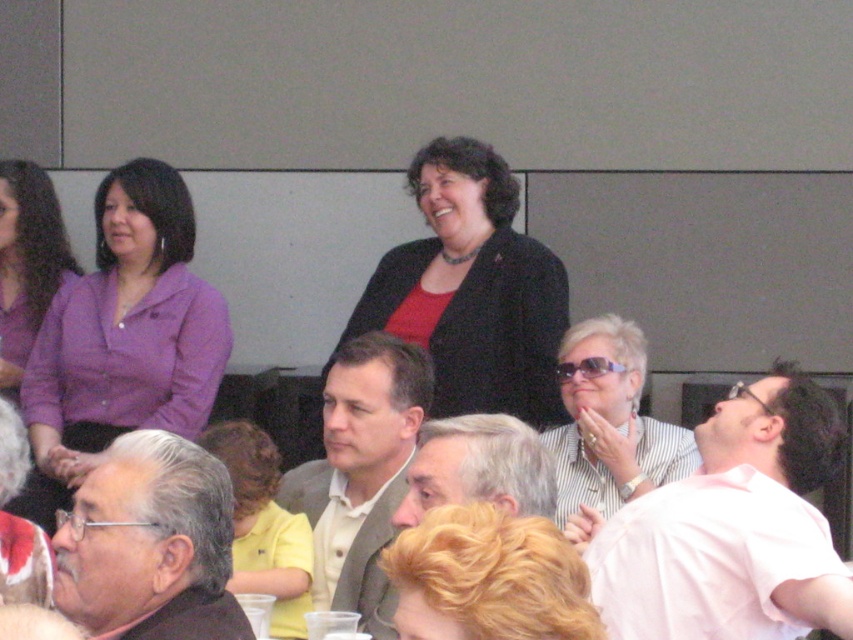
Between light brown textured blazer at center and gray hair at center, which one appears on the right side from the viewer's perspective?

gray hair at center is more to the right.

Does light brown textured blazer at center appear over gray hair at center?

Actually, light brown textured blazer at center is below gray hair at center.

Who is more forward, (376, 566) or (512, 465)?

Point (512, 465) is more forward.

The width and height of the screenshot is (853, 640). I want to click on light brown textured blazer at center, so click(x=360, y=472).

Is gray hair at lower left positioned behind yellow matte shirt at center?

No, gray hair at lower left is in front of yellow matte shirt at center.

Does point (161, 531) come behind point (306, 545)?

That is False.

Between point (141, 628) and point (270, 588), which one is positioned in front?

Point (141, 628) is in front.

At what (x,y) coordinates should I click in order to perform the action: click on gray hair at lower left. Please return your answer as a coordinate pair (x, y). The width and height of the screenshot is (853, 640). Looking at the image, I should click on (149, 545).

Can you confirm if striped fabric shirt at center is positioned above matte purple sweater at upper left?

No.

Who is positioned more to the left, striped fabric shirt at center or matte purple sweater at upper left?

matte purple sweater at upper left is more to the left.

Does point (614, 396) come farther from viewer compared to point (22, 340)?

No, it is not.

This screenshot has width=853, height=640. What are the coordinates of `striped fabric shirt at center` in the screenshot? It's located at (610, 422).